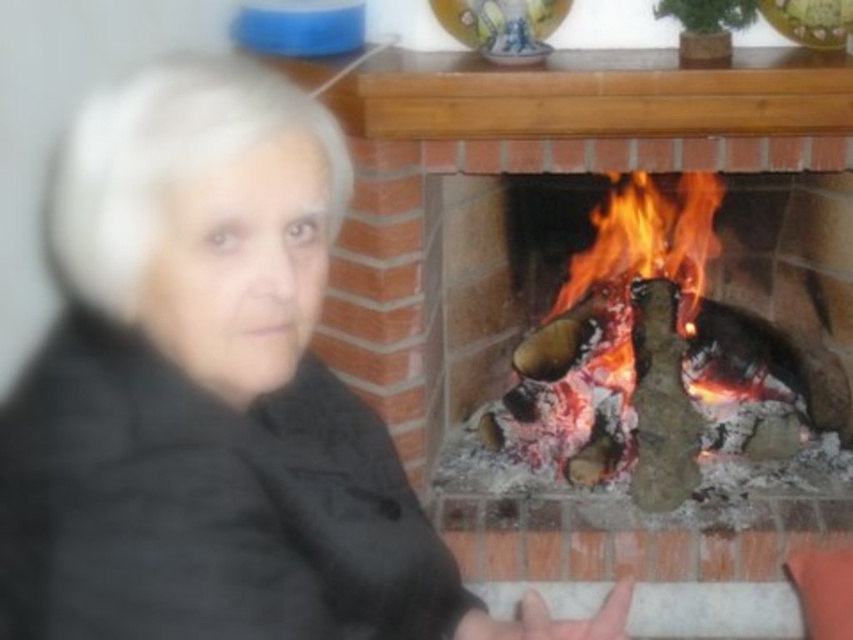
You are a guest at this cozy indoor scene and want to sit closer to the charred wood fire at center to warm up. However, there is a black quilted jacket at left in the way. Can you move the jacket to make space? Explain your reasoning based on their sizes.

The black quilted jacket at left is smaller than the charred wood fire at center. Since the jacket is smaller, it can be easily moved out of the way to create space near the fire.

Consider the image. You are standing in the room and want to determine which of the two points, point (219, 628) or point (722, 385), is nearer to you. Based on the scene, which point is closer?

Point (219, 628) is closer to the viewer than point (722, 385).

You are standing in the room and see the point at coordinates (120, 544). If you want to move towards the fireplace, which direction should you walk?

The point at coordinates 0.852, 0.142 is 25.58 inches away from the fireplace. You should walk towards the fireplace in the direction opposite to the point to reach it.